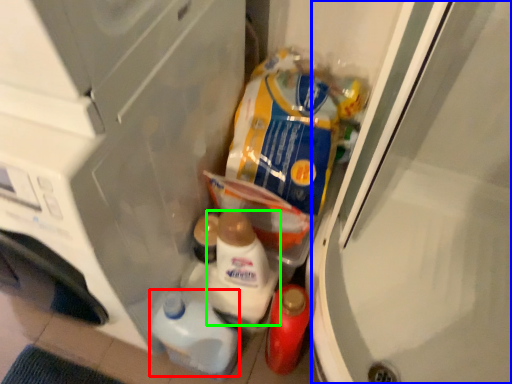
Question: Which object is the farthest from snack (highlighted by a red box)? Choose among these: screen door (highlighted by a blue box) or snack (highlighted by a green box).

Choices:
 (A) screen door
 (B) snack

Answer: (A)